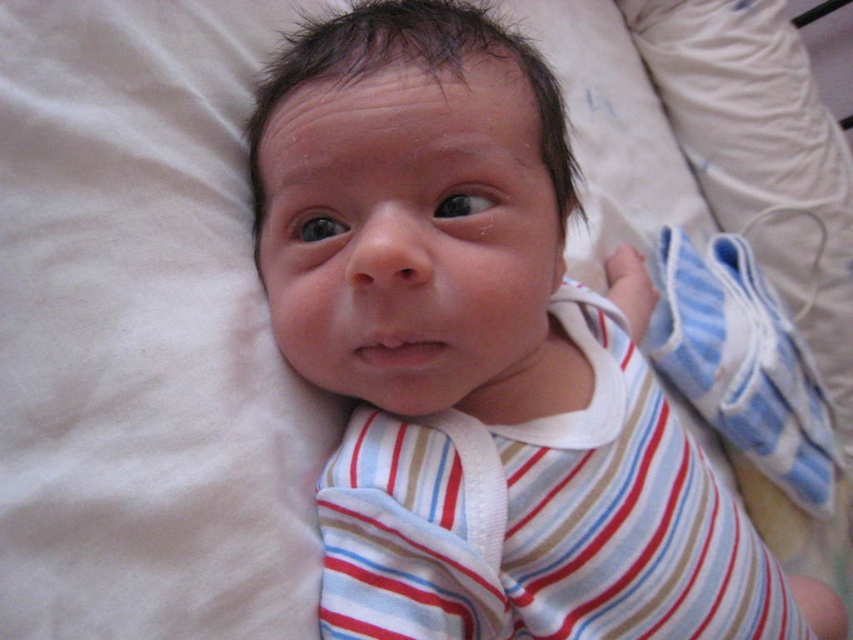
You are a nurse in a hospital nursery. You need to place the striped fabric baby at center into a bassinet that can only accommodate items up to 2 inches in length. Can the striped cotton shirt at center be placed alongside the baby without exceeding the bassinet length limit?

The distance between the striped fabric baby at center and the striped cotton shirt at center is 1.90 inches. Since the bassinet can hold items up to 2 inches in length, the striped cotton shirt at center can be placed alongside the baby as the combined length would not exceed the limit.

Based on the scene description, which object is taller between the striped fabric baby at center and the striped cotton shirt at center?

The striped fabric baby at center is much taller than the striped cotton shirt at center.